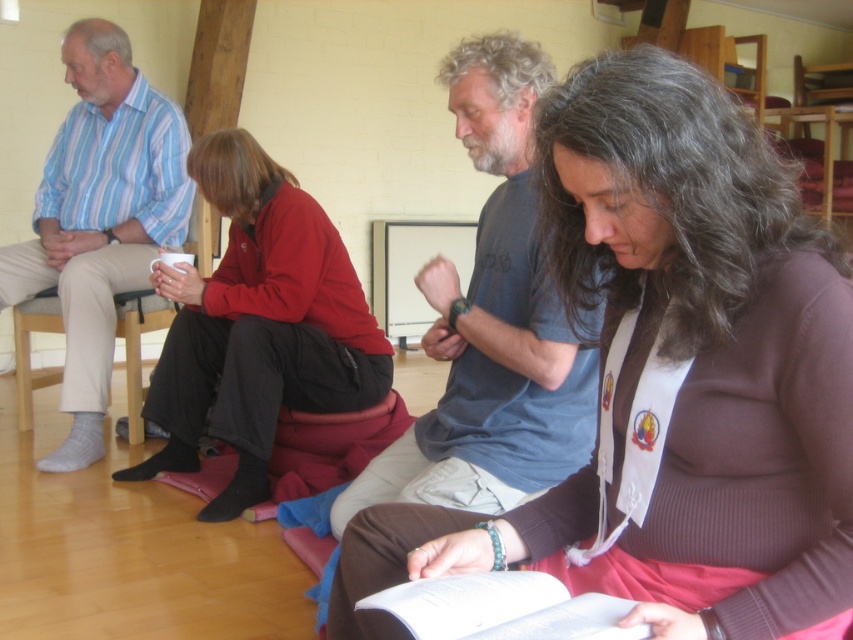
You are an observer standing in front of the image. You notice two clothing items, the brown ribbed sweater at center and the striped cotton shirt at left. Which clothing item is positioned lower in the image?

The brown ribbed sweater at center is positioned lower than the striped cotton shirt at left in the image.